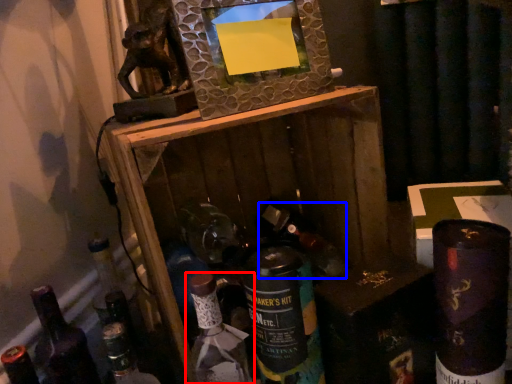
Question: Which of the following is the farthest to the observer, bottle (highlighted by a red box) or wine bottle (highlighted by a blue box)?

Choices:
 (A) bottle
 (B) wine bottle

Answer: (B)